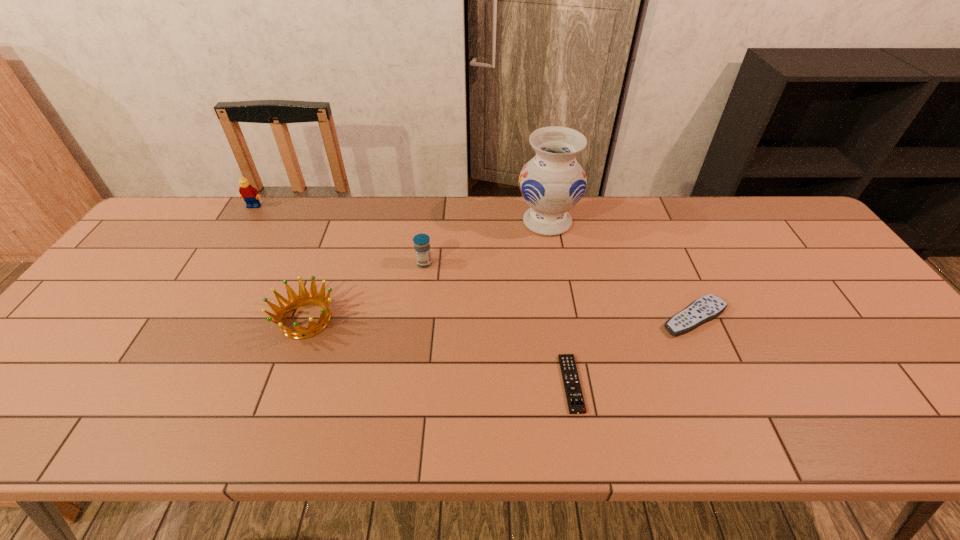
Find the location of a particular element. The width and height of the screenshot is (960, 540). free spot between the vase and the third object from left to right is located at coordinates (486, 242).

The width and height of the screenshot is (960, 540). In order to click on free space between the second object from left to right and the fourth nearest object in this screenshot , I will do [x=365, y=292].

Identify which object is located as the fifth nearest to the right remote control. Please provide its 2D coordinates. Your answer should be formatted as a tuple, i.e. [(x, y)], where the tuple contains the x and y coordinates of a point satisfying the conditions above.

[(250, 194)]

The width and height of the screenshot is (960, 540). In order to click on object identified as the second closest to the leftmost object in this screenshot , I will do `click(421, 241)`.

Locate an element on the screen. Image resolution: width=960 pixels, height=540 pixels. free location that satisfies the following two spatial constraints: 1. on the front-facing side of the Lego; 2. on the left side of the left remote control is located at coordinates (146, 383).

Image resolution: width=960 pixels, height=540 pixels. Find the location of `free space that satisfies the following two spatial constraints: 1. on the front-facing side of the Lego; 2. on the right side of the second object from left to right`. free space that satisfies the following two spatial constraints: 1. on the front-facing side of the Lego; 2. on the right side of the second object from left to right is located at coordinates (184, 320).

Where is `blank area in the image that satisfies the following two spatial constraints: 1. on the front-facing side of the nearer remote control; 2. on the left side of the Lego`? The width and height of the screenshot is (960, 540). blank area in the image that satisfies the following two spatial constraints: 1. on the front-facing side of the nearer remote control; 2. on the left side of the Lego is located at coordinates (146, 383).

This screenshot has width=960, height=540. I want to click on vacant area in the image that satisfies the following two spatial constraints: 1. on the front-facing side of the fifth object from right to left; 2. on the right side of the Lego, so click(x=184, y=320).

Image resolution: width=960 pixels, height=540 pixels. Identify the location of blank area in the image that satisfies the following two spatial constraints: 1. on the front side of the rightmost object; 2. on the right side of the vase. (564, 318).

Where is `vacant space that satisfies the following two spatial constraints: 1. on the front-facing side of the tallest object; 2. on the left side of the Lego`? The width and height of the screenshot is (960, 540). vacant space that satisfies the following two spatial constraints: 1. on the front-facing side of the tallest object; 2. on the left side of the Lego is located at coordinates (245, 222).